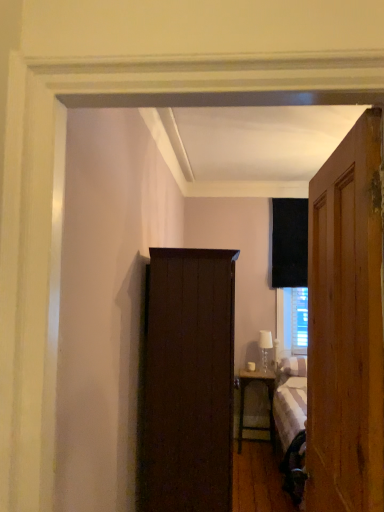
Question: Is wooden nightstand at right facing away from wooden door at right?

Choices:
 (A) no
 (B) yes

Answer: (A)

Question: Can you confirm if wooden nightstand at right is smaller than wooden door at right?

Choices:
 (A) no
 (B) yes

Answer: (B)

Question: From the image's perspective, would you say wooden nightstand at right is positioned over wooden door at right?

Choices:
 (A) no
 (B) yes

Answer: (A)

Question: Considering the relative sizes of wooden nightstand at right and wooden door at right in the image provided, is wooden nightstand at right taller than wooden door at right?

Choices:
 (A) no
 (B) yes

Answer: (A)

Question: Is the position of wooden nightstand at right more distant than that of wooden door at right?

Choices:
 (A) no
 (B) yes

Answer: (B)

Question: Considering their positions, is dark wood cupboard at left located in front of or behind white glass table lamp at right?

Choices:
 (A) front
 (B) behind

Answer: (A)

Question: In terms of width, does dark wood cupboard at left look wider or thinner when compared to white glass table lamp at right?

Choices:
 (A) thin
 (B) wide

Answer: (B)

Question: Considering the positions of dark wood cupboard at left and white glass table lamp at right in the image, is dark wood cupboard at left bigger or smaller than white glass table lamp at right?

Choices:
 (A) big
 (B) small

Answer: (A)

Question: Considering the relative positions of dark wood cupboard at left and white glass table lamp at right in the image provided, is dark wood cupboard at left to the left or to the right of white glass table lamp at right?

Choices:
 (A) right
 (B) left

Answer: (B)

Question: From a real-world perspective, is wooden nightstand at right above or below wooden door at right?

Choices:
 (A) below
 (B) above

Answer: (A)

Question: Is point click(243, 420) closer or farther from the camera than point click(314, 217)?

Choices:
 (A) farther
 (B) closer

Answer: (A)

Question: Visually, is wooden nightstand at right positioned to the left or to the right of wooden door at right?

Choices:
 (A) right
 (B) left

Answer: (A)

Question: Is wooden nightstand at right situated inside wooden door at right or outside?

Choices:
 (A) outside
 (B) inside

Answer: (A)

Question: Is white glass table lamp at right bigger or smaller than wooden door at right?

Choices:
 (A) small
 (B) big

Answer: (A)

Question: From a real-world perspective, is white glass table lamp at right above or below wooden door at right?

Choices:
 (A) below
 (B) above

Answer: (A)